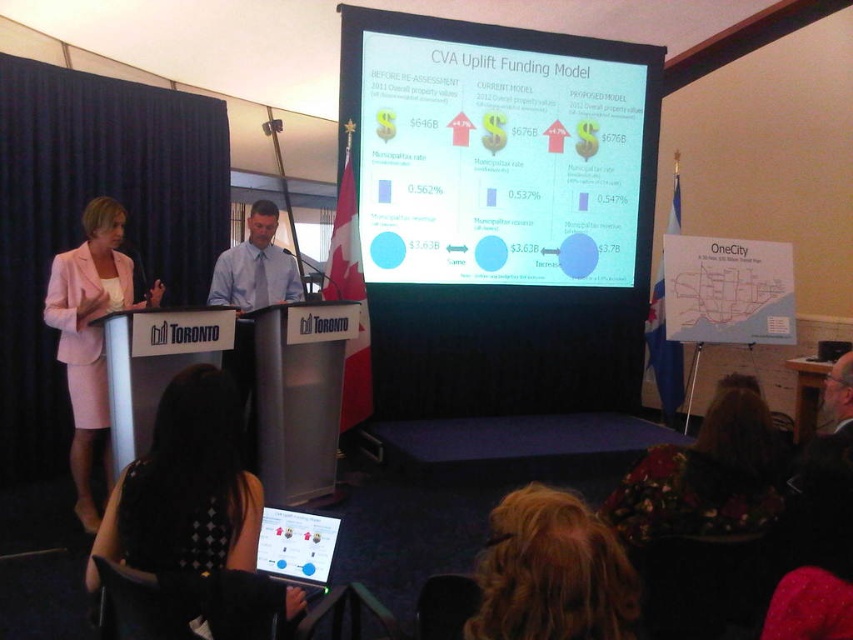
Question: Among these objects, which one is farthest from the camera?

Choices:
 (A) blue shirt at center
 (B) pink fabric suit at left
 (C) blonde hair at lower center
 (D) white glossy projection screen at center

Answer: (D)

Question: Is black mesh dress at lower center above blonde hair at lower center?

Choices:
 (A) yes
 (B) no

Answer: (A)

Question: Is white glossy projection screen at center further to camera compared to floral fabric dress at lower right?

Choices:
 (A) no
 (B) yes

Answer: (B)

Question: From the image, what is the correct spatial relationship of black mesh dress at lower center in relation to blue shirt at center?

Choices:
 (A) left
 (B) right

Answer: (B)

Question: Considering the real-world distances, which object is farthest from the blue shirt at center?

Choices:
 (A) floral fabric dress at lower right
 (B) black mesh dress at lower center
 (C) white glossy projection screen at center
 (D) blonde hair at lower center

Answer: (D)

Question: Estimate the real-world distances between objects in this image. Which object is farther from the blue shirt at center?

Choices:
 (A) matte plastic tablet at lower center
 (B) pink fabric suit at left
 (C) black mesh dress at lower center

Answer: (C)